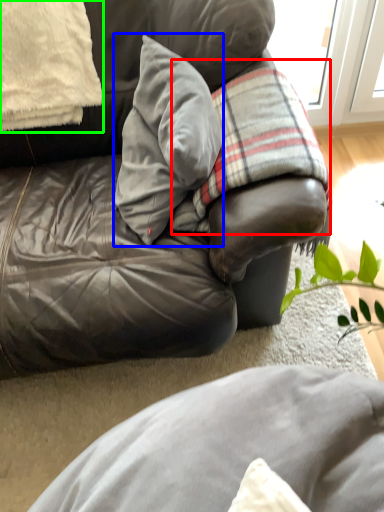
Question: Which is farther away from plaid (highlighted by a red box)? pillow (highlighted by a blue box) or pillow (highlighted by a green box)?

Choices:
 (A) pillow
 (B) pillow

Answer: (B)